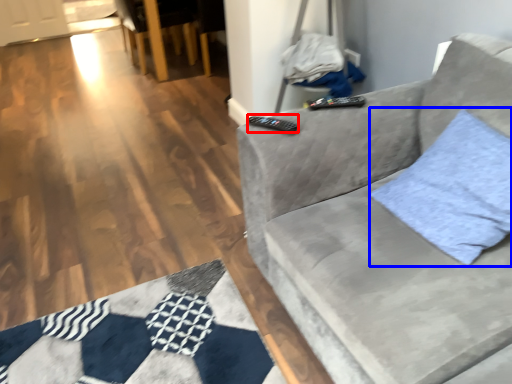
Question: Which object is further to the camera taking this photo, remote (highlighted by a red box) or throw pillow (highlighted by a blue box)?

Choices:
 (A) remote
 (B) throw pillow

Answer: (A)